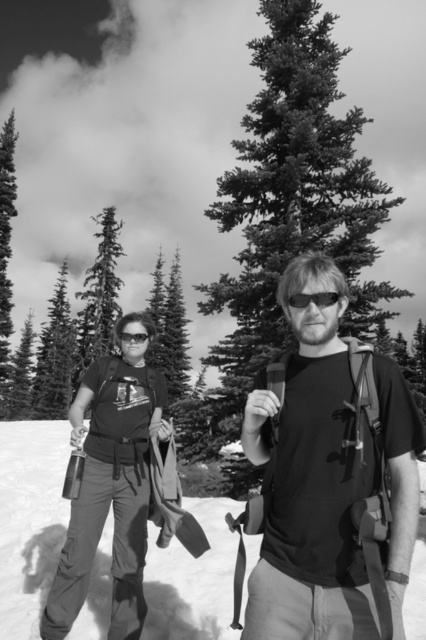
Question: Based on their relative distances, which object is nearer to the matte black t-shirt at center?

Choices:
 (A) brushed metal water bottle at left
 (B) matte black goggles at center

Answer: (B)

Question: Which point is farther to the camera?

Choices:
 (A) matte black t-shirt at center
 (B) white snow at lower left

Answer: (B)

Question: Does brushed metal water bottle at left have a larger size compared to matte black goggles at left?

Choices:
 (A) yes
 (B) no

Answer: (A)

Question: Does smooth dark green pine tree at center appear on the right side of white snow at lower left?

Choices:
 (A) yes
 (B) no

Answer: (A)

Question: Estimate the real-world distances between objects in this image. Which object is closer to the matte black goggles at left?

Choices:
 (A) brushed metal water bottle at left
 (B) white snow at lower left
 (C) smooth dark green pine tree at center

Answer: (A)

Question: In this image, where is smooth dark green pine tree at center located relative to white snow at lower left?

Choices:
 (A) below
 (B) above

Answer: (B)